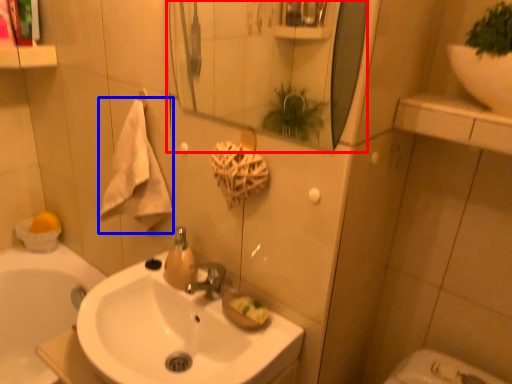
Question: Among these objects, which one is farthest to the camera, mirror (highlighted by a red box) or bath towel (highlighted by a blue box)?

Choices:
 (A) mirror
 (B) bath towel

Answer: (B)